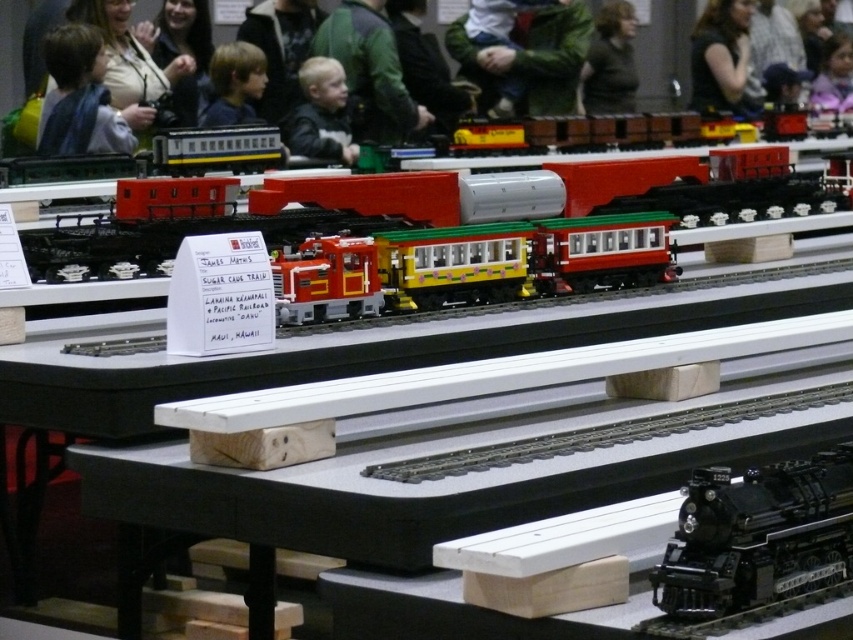
Question: Which object is farther from the camera taking this photo?

Choices:
 (A) dark brown sweater at upper center
 (B) blonde hair at center
 (C) blue fabric at upper left
 (D) yellow matte train car at center

Answer: (A)

Question: Among these objects, which one is farthest from the camera?

Choices:
 (A) dark brown hair at upper right
 (B) shiny black locomotive at lower right
 (C) blue fabric at upper left
 (D) dark brown sweater at upper center

Answer: (D)

Question: Where is blue fabric at upper left located in relation to dark brown hair at upper right in the image?

Choices:
 (A) below
 (B) above

Answer: (A)

Question: Among these objects, which one is nearest to the camera?

Choices:
 (A) blonde hair at center
 (B) shiny black locomotive at lower right

Answer: (B)

Question: Considering the relative positions of blue fabric at upper left and dark blue shirt at upper center in the image provided, where is blue fabric at upper left located with respect to dark blue shirt at upper center?

Choices:
 (A) right
 (B) left

Answer: (B)

Question: Is black plastic table at center below dark brown hair at upper right?

Choices:
 (A) no
 (B) yes

Answer: (B)